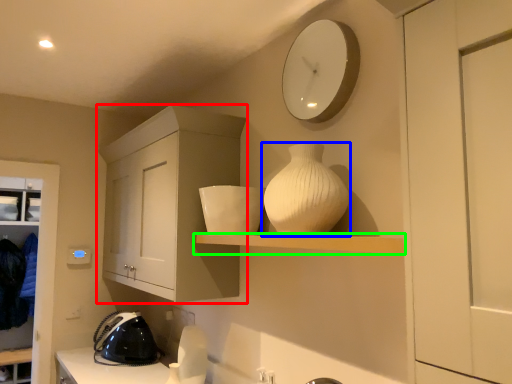
Question: Considering the real-world distances, which object is closest to cabinetry (highlighted by a red box)? vase (highlighted by a blue box) or shelf (highlighted by a green box).

Choices:
 (A) vase
 (B) shelf

Answer: (B)